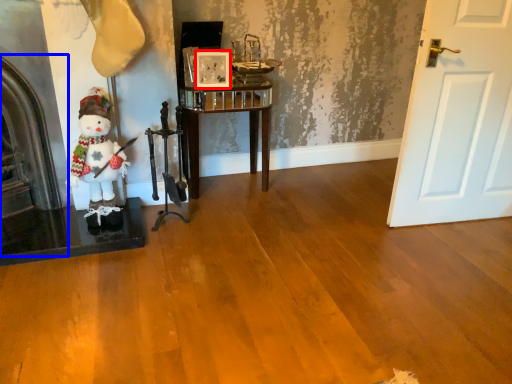
Question: Which object appears closest to the camera in this image, picture frame (highlighted by a red box) or fireplace (highlighted by a blue box)?

Choices:
 (A) picture frame
 (B) fireplace

Answer: (B)